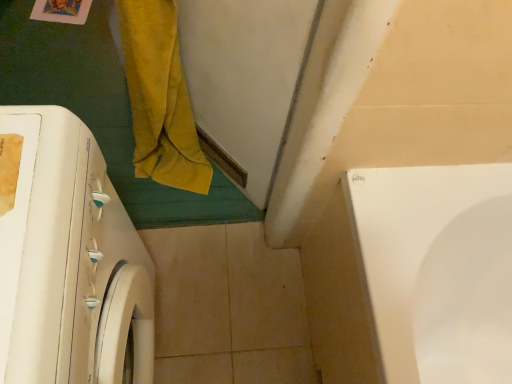
Question: Should I look upward or downward to see white glossy washing machine at left?

Choices:
 (A) down
 (B) up

Answer: (A)

Question: Does white glossy washing machine at left have a greater height compared to yellow velvety bath towel at left?

Choices:
 (A) no
 (B) yes

Answer: (B)

Question: Does white glossy washing machine at left have a greater width compared to yellow velvety bath towel at left?

Choices:
 (A) no
 (B) yes

Answer: (B)

Question: Does white glossy washing machine at left lie in front of yellow velvety bath towel at left?

Choices:
 (A) yes
 (B) no

Answer: (A)

Question: From a real-world perspective, is white glossy washing machine at left beneath yellow velvety bath towel at left?

Choices:
 (A) no
 (B) yes

Answer: (A)

Question: Considering the relative sizes of white glossy washing machine at left and yellow velvety bath towel at left in the image provided, is white glossy washing machine at left shorter than yellow velvety bath towel at left?

Choices:
 (A) yes
 (B) no

Answer: (B)

Question: Is white glossy washing machine at left located outside yellow velvety bath towel at left?

Choices:
 (A) yes
 (B) no

Answer: (A)

Question: Is yellow velvety bath towel at left facing away from white glossy washing machine at left?

Choices:
 (A) no
 (B) yes

Answer: (A)

Question: From the image's perspective, would you say yellow velvety bath towel at left is positioned over white glossy washing machine at left?

Choices:
 (A) yes
 (B) no

Answer: (A)

Question: Is yellow velvety bath towel at left closer to camera compared to white glossy washing machine at left?

Choices:
 (A) no
 (B) yes

Answer: (A)

Question: From a real-world perspective, is yellow velvety bath towel at left positioned under white glossy washing machine at left based on gravity?

Choices:
 (A) no
 (B) yes

Answer: (B)

Question: From the image's perspective, does yellow velvety bath towel at left appear lower than white glossy washing machine at left?

Choices:
 (A) yes
 (B) no

Answer: (B)

Question: Does yellow velvety bath towel at left have a greater height compared to white glossy washing machine at left?

Choices:
 (A) no
 (B) yes

Answer: (A)

Question: Looking at their shapes, would you say yellow velvety bath towel at left is wider or thinner than white glossy washing machine at left?

Choices:
 (A) thin
 (B) wide

Answer: (A)